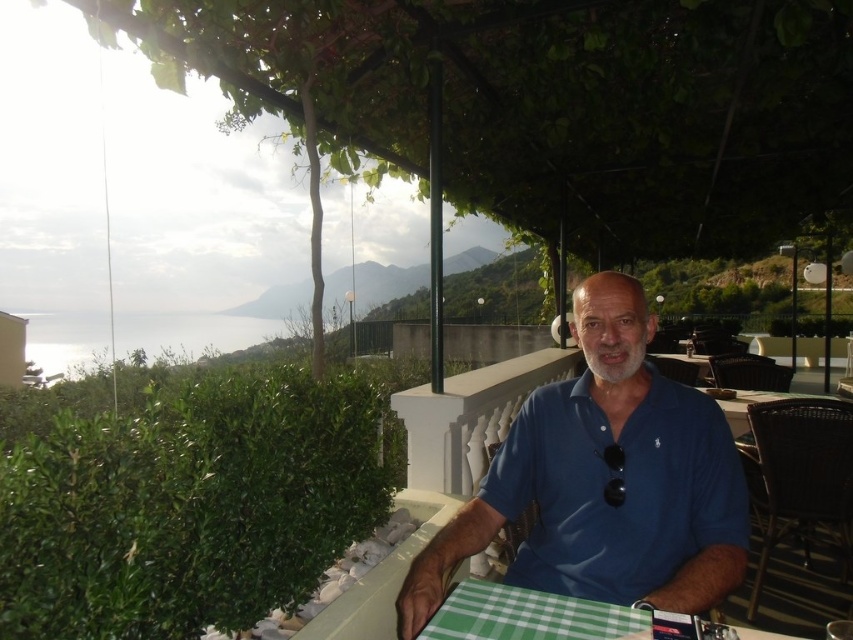
Question: Can you confirm if blue cotton shirt at center is smaller than green checkered tablecloth at lower center?

Choices:
 (A) yes
 (B) no

Answer: (B)

Question: Which object is closer to the camera taking this photo?

Choices:
 (A) blue cotton shirt at center
 (B) green checkered tablecloth at lower center

Answer: (B)

Question: Does blue cotton shirt at center appear under green checkered tablecloth at lower center?

Choices:
 (A) yes
 (B) no

Answer: (B)

Question: Is blue cotton shirt at center closer to the viewer compared to green checkered tablecloth at lower center?

Choices:
 (A) no
 (B) yes

Answer: (A)